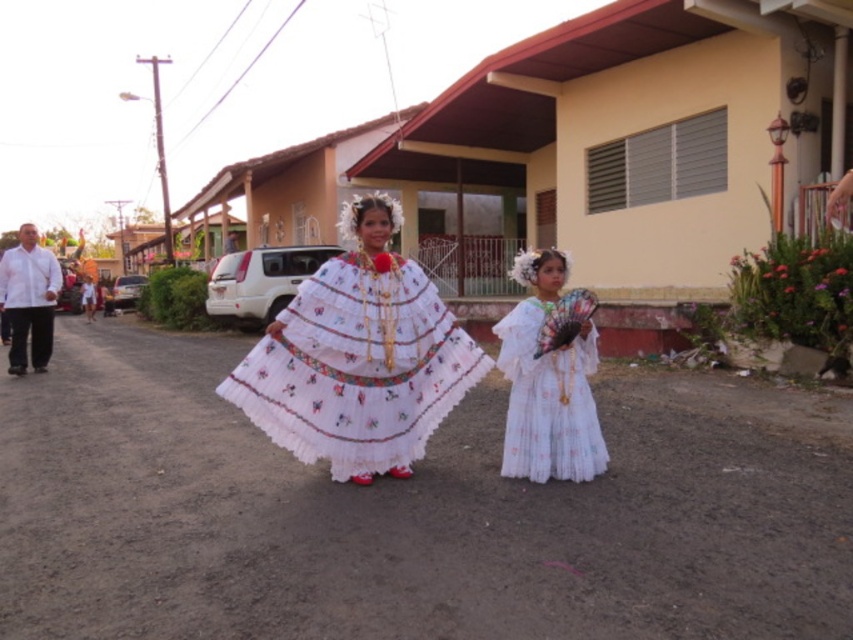
From the picture: Who is positioned more to the right, white embroidered dress at center or white cotton dress at center?

white cotton dress at center

The height and width of the screenshot is (640, 853). What are the coordinates of `white embroidered dress at center` in the screenshot? It's located at (358, 356).